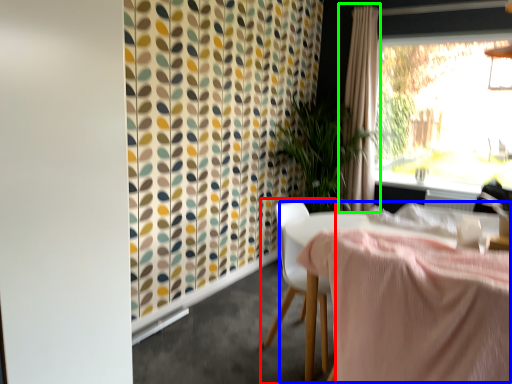
Question: Based on their relative distances, which object is nearer to chair (highlighted by a red box)? Choose from table (highlighted by a blue box) and curtain (highlighted by a green box).

Choices:
 (A) table
 (B) curtain

Answer: (A)